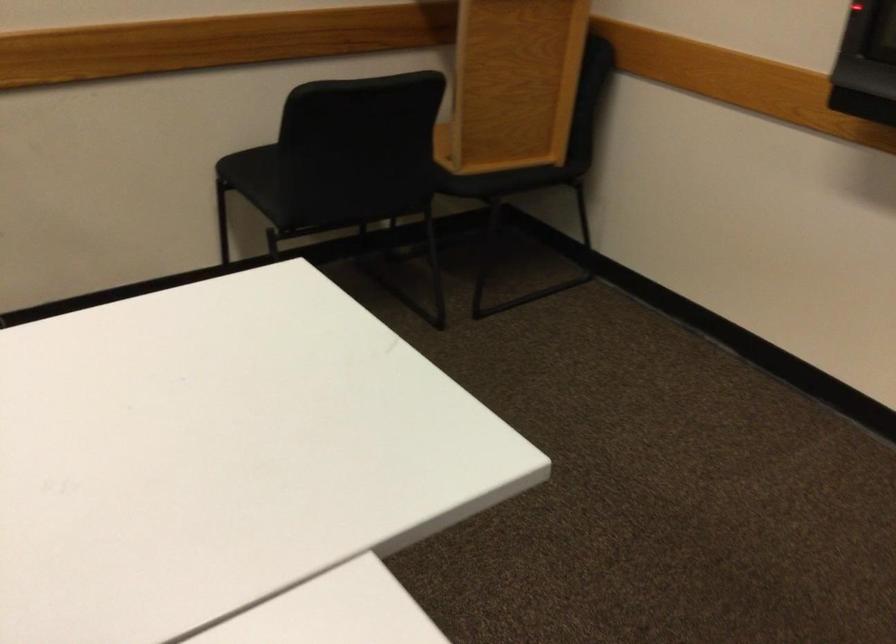
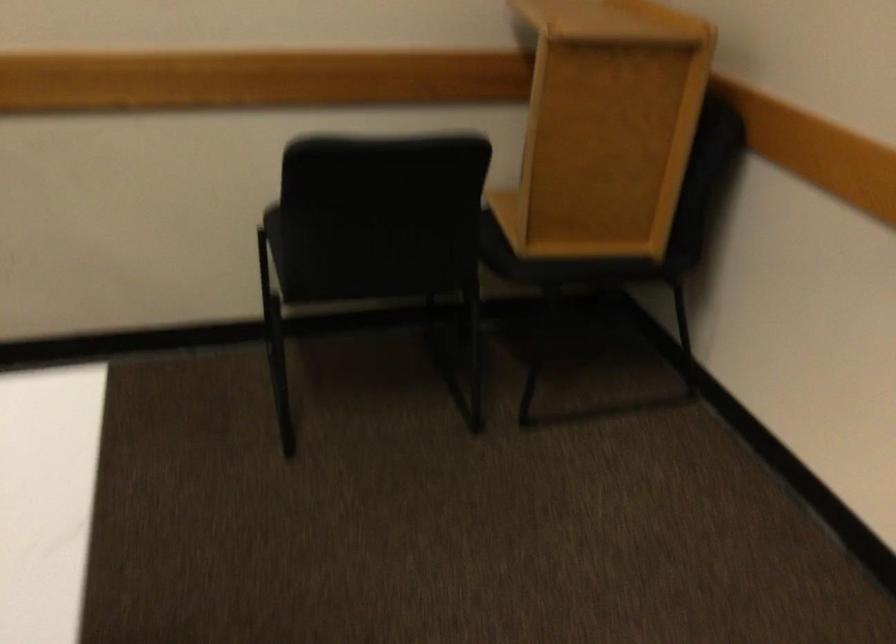
Where in the second image is the point corresponding to point 334,184 from the first image?

(348, 250)